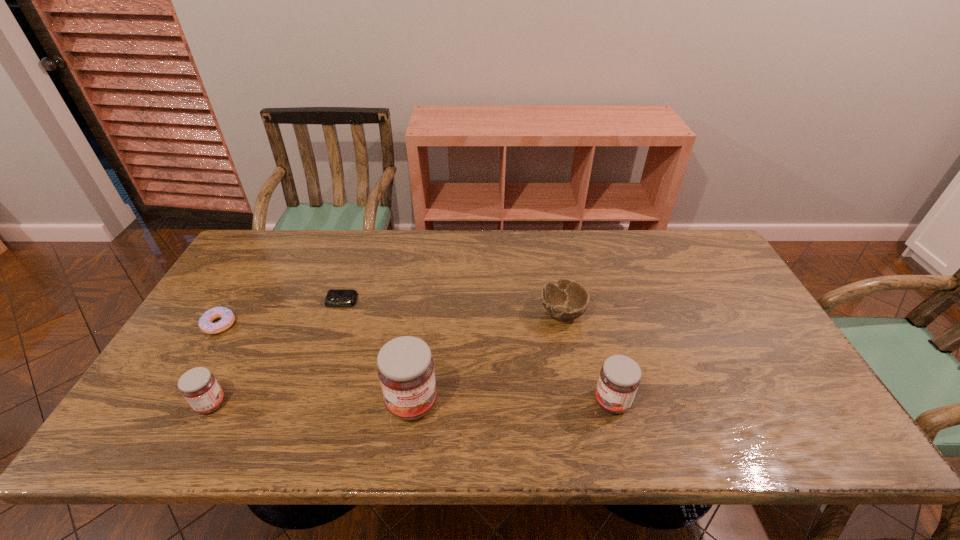
This screenshot has height=540, width=960. I want to click on free spot between the fifth object from right to left and the second shortest object, so click(x=215, y=364).

Locate an element on the screen. The width and height of the screenshot is (960, 540). free space between the third object from left to right and the third shortest object is located at coordinates tap(452, 307).

Select which object is the fourth closest to the alarm clock. Please provide its 2D coordinates. Your answer should be formatted as a tuple, i.e. [(x, y)], where the tuple contains the x and y coordinates of a point satisfying the conditions above.

[(567, 300)]

Where is `the fifth closest object to the second shortest object`? the fifth closest object to the second shortest object is located at coordinates (619, 379).

What are the coordinates of `jam object that ranks as the third closest to the bowl` in the screenshot? It's located at (199, 387).

Locate an element on the screen. jam that is the third closest to the fourth tallest object is located at coordinates (199, 387).

Locate an element on the screen. free space in the image that satisfies the following two spatial constraints: 1. on the display of the shortest object; 2. on the right side of the fourth tallest object is located at coordinates (338, 313).

Locate an element on the screen. This screenshot has height=540, width=960. blank space that satisfies the following two spatial constraints: 1. on the display of the alarm clock; 2. on the right side of the fifth shortest object is located at coordinates (307, 401).

Image resolution: width=960 pixels, height=540 pixels. Identify the location of free space that satisfies the following two spatial constraints: 1. on the back side of the second jam from right to left; 2. on the left side of the second object from left to right. (212, 403).

Where is `free space that satisfies the following two spatial constraints: 1. on the front side of the bowl; 2. on the left side of the rightmost jam`? This screenshot has width=960, height=540. free space that satisfies the following two spatial constraints: 1. on the front side of the bowl; 2. on the left side of the rightmost jam is located at coordinates 580,401.